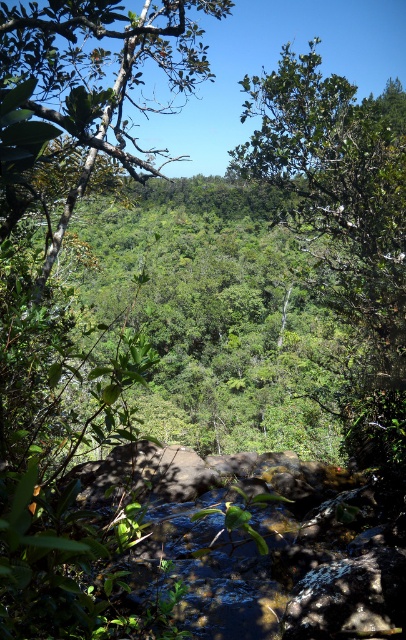
Question: Which point is farther to the camera?

Choices:
 (A) green leafy tree at center
 (B) green leafy tree at upper left

Answer: (A)

Question: Is green leafy tree at center below green leafy tree at upper left?

Choices:
 (A) no
 (B) yes

Answer: (B)

Question: Does green leafy tree at center appear under green leafy tree at upper left?

Choices:
 (A) yes
 (B) no

Answer: (A)

Question: Which point appears closest to the camera in this image?

Choices:
 (A) (43, 196)
 (B) (377, 170)

Answer: (A)

Question: Can you confirm if green leafy tree at center is positioned below green leafy tree at upper left?

Choices:
 (A) no
 (B) yes

Answer: (B)